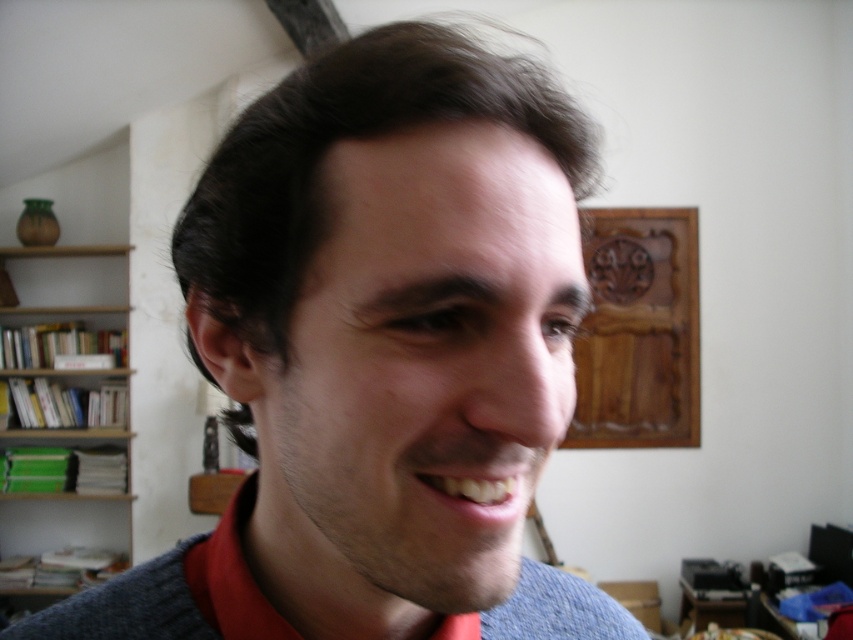
Question: Among these points, which one is nearest to the camera?

Choices:
 (A) (55, 288)
 (B) (345, 504)

Answer: (B)

Question: Does gray wool sweater at center have a smaller size compared to wooden shelves at left?

Choices:
 (A) no
 (B) yes

Answer: (B)

Question: Is gray wool sweater at center to the right of wooden shelves at left from the viewer's perspective?

Choices:
 (A) no
 (B) yes

Answer: (B)

Question: Is gray wool sweater at center thinner than wooden shelves at left?

Choices:
 (A) yes
 (B) no

Answer: (A)